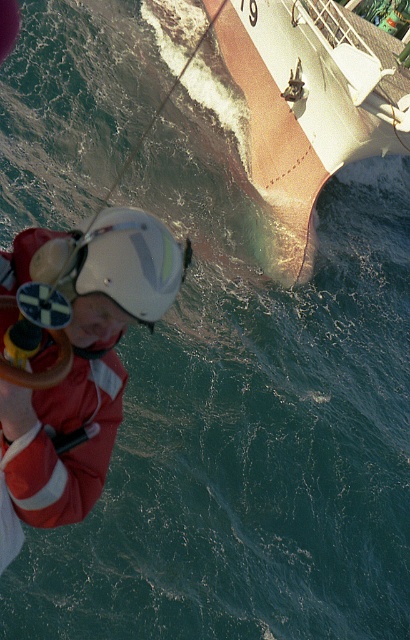
Question: Is red reflective jacket at left below white matte helmet at center?

Choices:
 (A) yes
 (B) no

Answer: (A)

Question: Considering the relative positions of smooth pinkish boat at upper center and white matte helmet at center in the image provided, where is smooth pinkish boat at upper center located with respect to white matte helmet at center?

Choices:
 (A) below
 (B) above

Answer: (B)

Question: Estimate the real-world distances between objects in this image. Which object is closer to the white matte helmet at center?

Choices:
 (A) red reflective jacket at left
 (B) smooth pinkish boat at upper center

Answer: (A)

Question: Among these points, which one is farthest from the camera?

Choices:
 (A) (29, 481)
 (B) (75, 280)

Answer: (B)

Question: Which object appears closest to the camera in this image?

Choices:
 (A) white matte helmet at center
 (B) red reflective jacket at left

Answer: (B)

Question: Does red reflective jacket at left have a greater width compared to smooth pinkish boat at upper center?

Choices:
 (A) no
 (B) yes

Answer: (A)